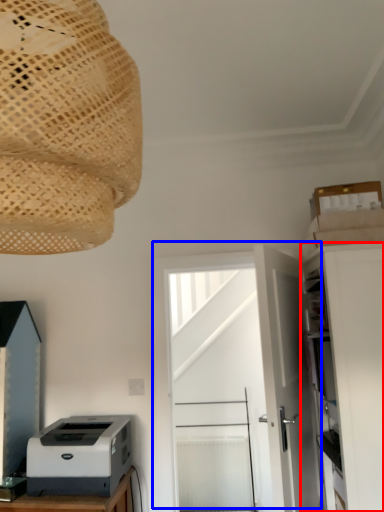
Question: Which of the following is the farthest to the observer, cabinetry (highlighted by a red box) or door (highlighted by a blue box)?

Choices:
 (A) cabinetry
 (B) door

Answer: (B)